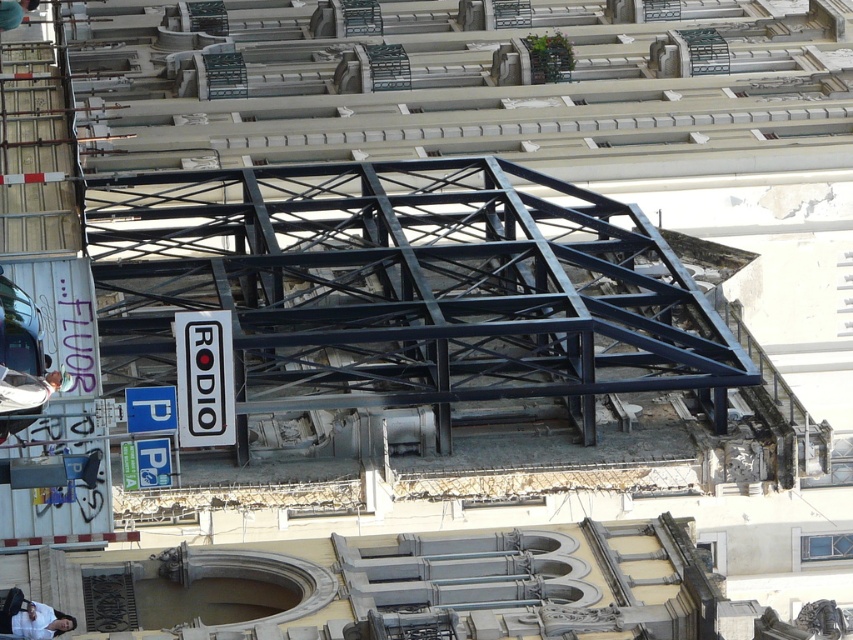
You are standing in the cityscape scene. Where is the white fabric shirt at lower left located?

The white fabric shirt at lower left is located at point (x=25, y=390).